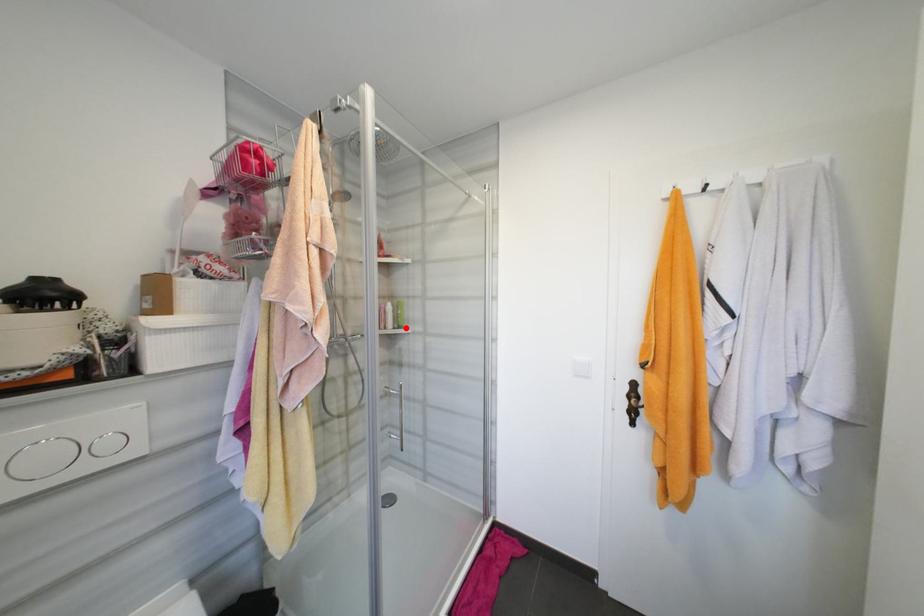
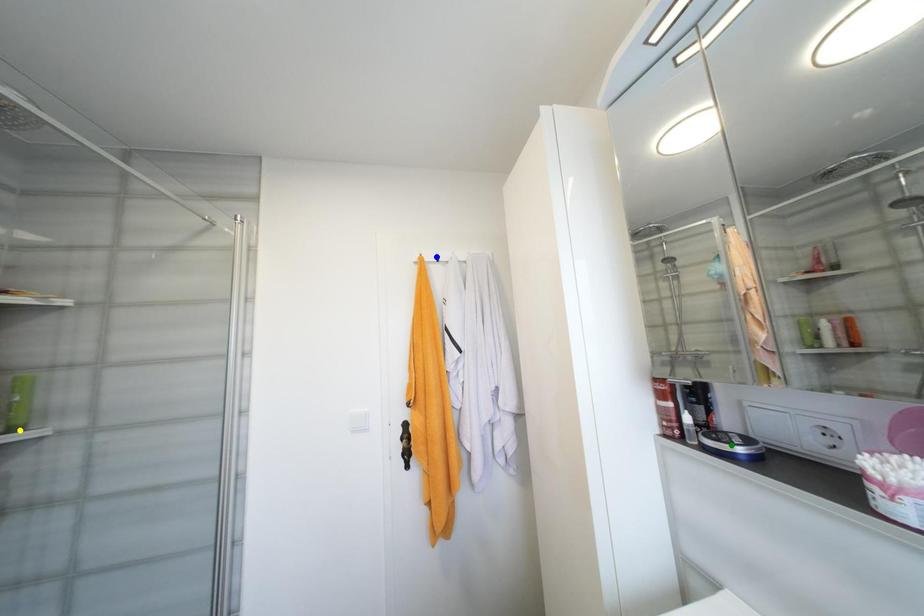
Question: I am providing you with two images of the same scene from different viewpoints. A red point is marked on the first image. You are given multiple points on the second image. Which spot in image 2 lines up with the point in image 1?

Choices:
 (A) blue point
 (B) green point
 (C) yellow point

Answer: (C)